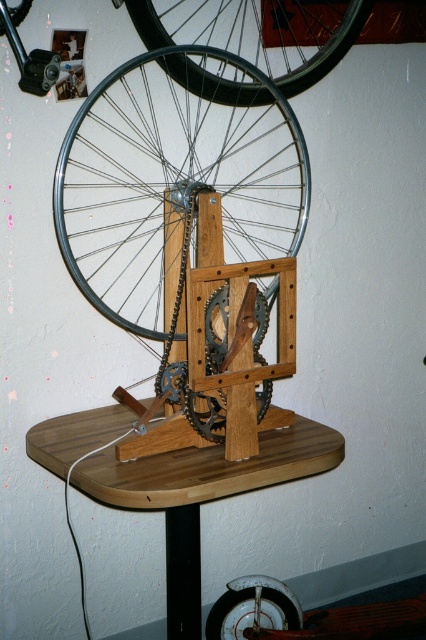
Based on the photo, you are a delivery person who needs to pack the metallic silver wheel at upper left and the black rubber tire at upper center into a box. The box can only fit items up to 1 meter in width. Can both items fit side by side in the box?

The metallic silver wheel at upper left might be wider than the black rubber tire at upper center. Since the box can only fit items up to 1 meter in width, we cannot confirm if both can fit side by side without knowing the exact widths of both items.

You are standing in front of the wooden stand with the bicycle wheel. There is a point labeled as point (x=175, y=173). Which object is located at this coordinate?

The metallic silver wheel at upper left is located at point (x=175, y=173).

You are a delivery person who just arrived at the scene and need to place a new wheel at the same location as the metallic silver wheel at upper left. What are the coordinates of the location where you should place the new wheel?

The coordinates for the metallic silver wheel at upper left are at point [175,173], so you should place the new wheel at those coordinates.